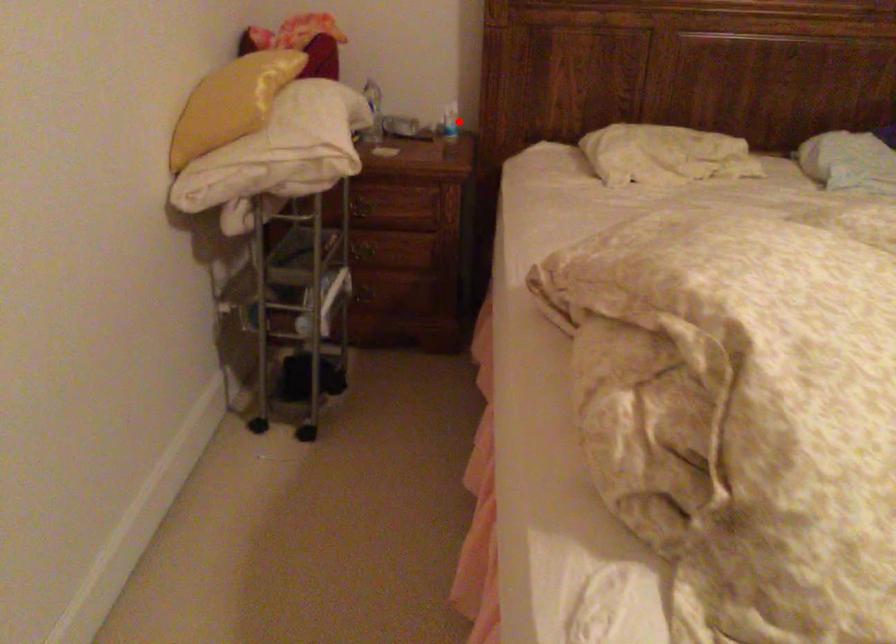
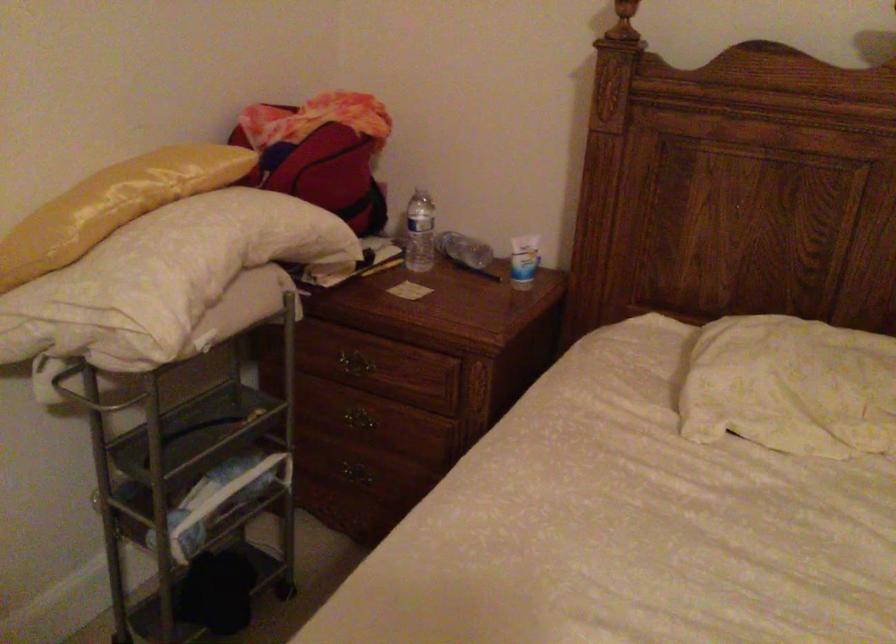
Question: I am providing you with two images of the same scene from different viewpoints. In image1, a red point is highlighted. Considering the same 3D point in image2, which of the following is correct?

Choices:
 (A) It is closer
 (B) It is farther

Answer: (A)